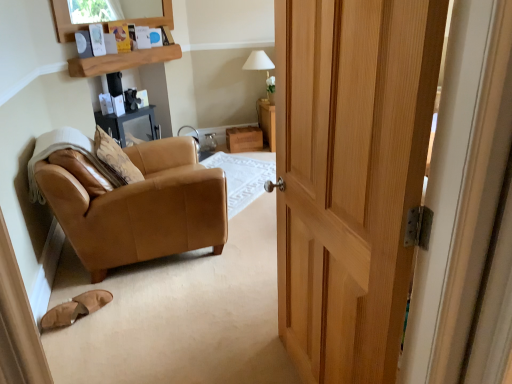
Locate an element on the screen. This screenshot has width=512, height=384. empty space that is in between tan leather chair at left and tan suede slippers at lower left is located at coordinates (157, 283).